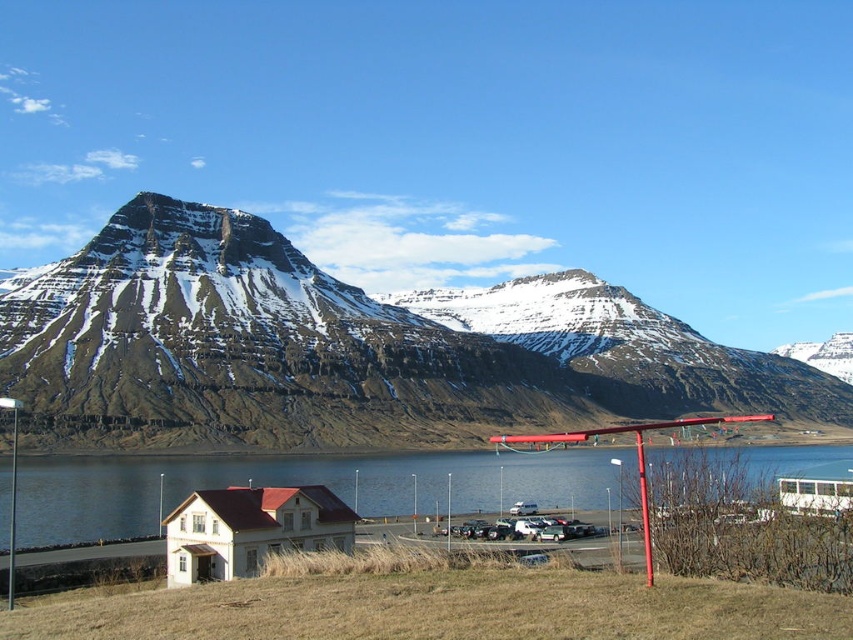
Is snowy rock mountain at upper center below blue water at lower center?

No.

Can you confirm if snowy rock mountain at upper center is taller than blue water at lower center?

Yes, snowy rock mountain at upper center is taller than blue water at lower center.

Does point (0, 304) lie behind point (107, 529)?

Yes, point (0, 304) is farther from viewer.

Where is `snowy rock mountain at upper center`? snowy rock mountain at upper center is located at coordinates (343, 348).

Based on the photo, can you confirm if snowy rock mountain at upper center is positioned to the right of metallic silver car at center?

Incorrect, snowy rock mountain at upper center is not on the right side of metallic silver car at center.

Is point (479, 396) more distant than point (537, 536)?

Yes, point (479, 396) is farther from viewer.

Identify the location of snowy rock mountain at upper center. (343, 348).

Image resolution: width=853 pixels, height=640 pixels. In order to click on snowy rock mountain at upper center in this screenshot , I will do `click(343, 348)`.

Can you confirm if blue water at lower center is bigger than metallic silver car at center?

Correct, blue water at lower center is larger in size than metallic silver car at center.

Is point (163, 472) less distant than point (598, 529)?

That is False.

Is point (602, 509) in front of point (508, 532)?

No, (602, 509) is behind (508, 532).

You are a GUI agent. You are given a task and a screenshot of the screen. Output one action in this format:
    pyautogui.click(x=<x>, y=<y>)
    Task: Click on the blue water at lower center
    This screenshot has width=853, height=640.
    Given the screenshot: What is the action you would take?
    pyautogui.click(x=305, y=483)